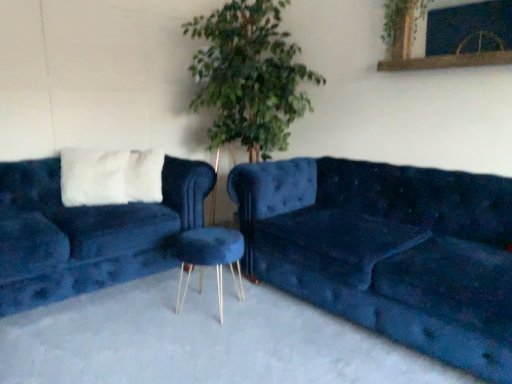
The width and height of the screenshot is (512, 384). Identify the location of free spot to the left of velvet blue stool at center. (148, 304).